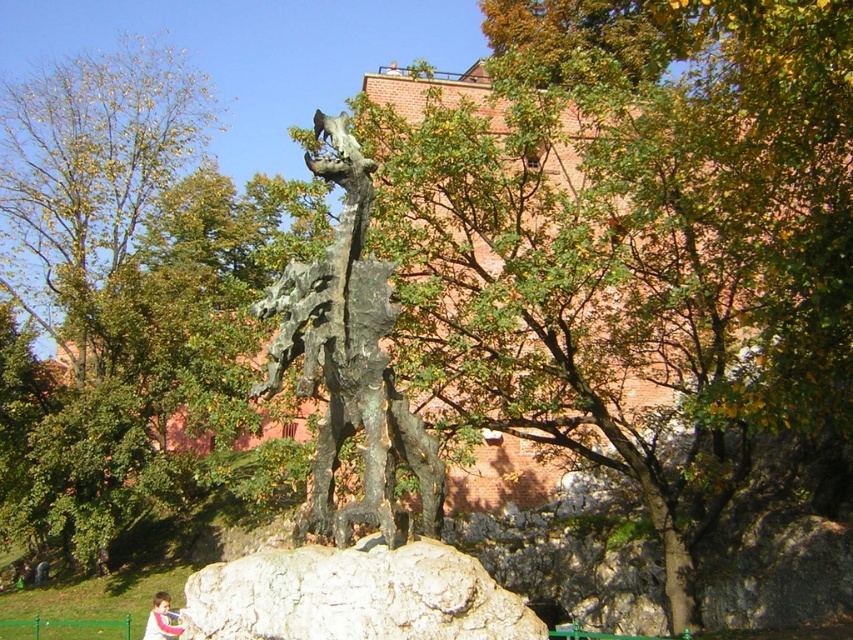
Question: Among these points, which one is farthest from the camera?

Choices:
 (A) (155, 595)
 (B) (363, 460)
 (C) (358, 609)

Answer: (A)

Question: Which point is farther to the camera?

Choices:
 (A) bronze textured dragon at center
 (B) gray rough rock at center

Answer: (A)

Question: Does bronze textured dragon at center have a smaller size compared to gray rough rock at center?

Choices:
 (A) yes
 (B) no

Answer: (B)

Question: Does gray rough rock at center appear over pink fabric at lower center?

Choices:
 (A) yes
 (B) no

Answer: (A)

Question: Estimate the real-world distances between objects in this image. Which object is closer to the pink fabric at lower center?

Choices:
 (A) gray rough rock at center
 (B) bronze textured dragon at center

Answer: (B)

Question: Does bronze textured dragon at center come in front of gray rough rock at center?

Choices:
 (A) yes
 (B) no

Answer: (B)